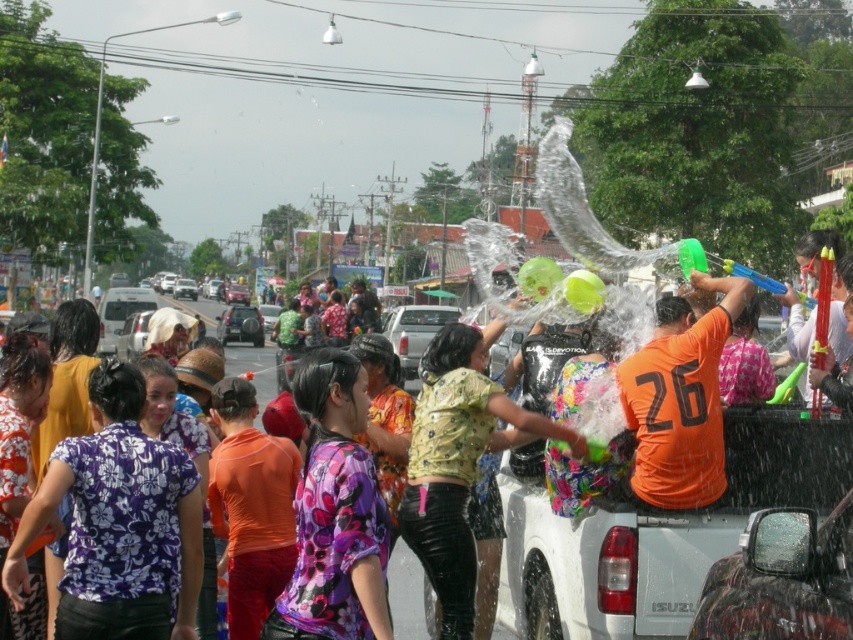
You are standing in the middle of the street during the water festival. You see two points in the scene, one at point (625, 385) and another at point (122, 337). Which point is closer to you?

Point (625, 385) is closer to the viewer than point (122, 337).

You are a photographer at the water festival. You want to capture a photo of the matte black car at center and the clear plastic mirror at lower right. Which object should you position to the right side of your camera frame to include both in the shot?

The clear plastic mirror at lower right is to the right of the matte black car at center, so you should position the clear plastic mirror at lower right on the right side of your camera frame to include both objects in the shot.

You are a photographer at the water festival. You want to capture a photo of the clear plastic mirror at lower right and the matte black car at center without any obstructions. Based on their positions, which object should be placed in the foreground to ensure the other is visible in the background?

The clear plastic mirror at lower right is below the matte black car at center, so placing the matte black car at center in the foreground would block the clear plastic mirror at lower right. To ensure both are visible without obstruction, position the clear plastic mirror at lower right in the foreground since it is lower and won